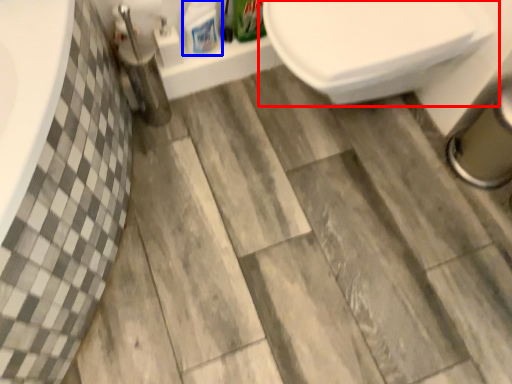
Question: Which point is closer to the camera, toilet (highlighted by a red box) or cleaning product (highlighted by a blue box)?

Choices:
 (A) toilet
 (B) cleaning product

Answer: (A)